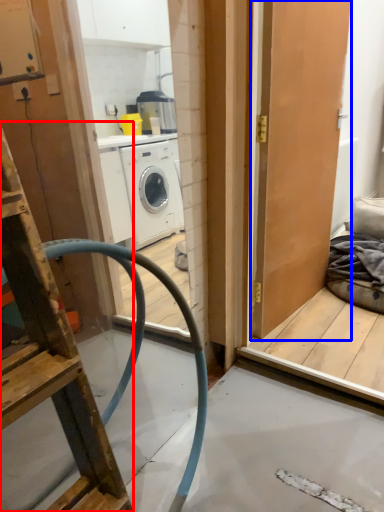
Question: Which point is further to the camera, ladder (highlighted by a red box) or door (highlighted by a blue box)?

Choices:
 (A) ladder
 (B) door

Answer: (B)